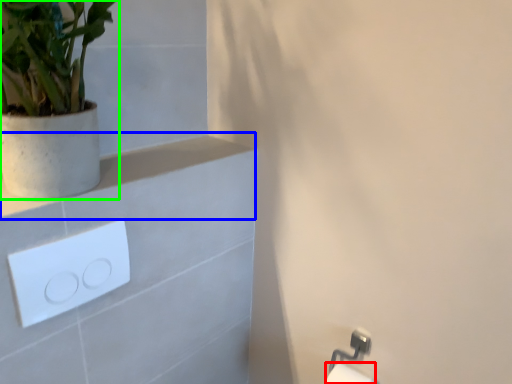
Question: Based on their relative distances, which object is farther from toilet paper (highlighted by a red box)? Choose from balustrade (highlighted by a blue box) and houseplant (highlighted by a green box).

Choices:
 (A) balustrade
 (B) houseplant

Answer: (B)